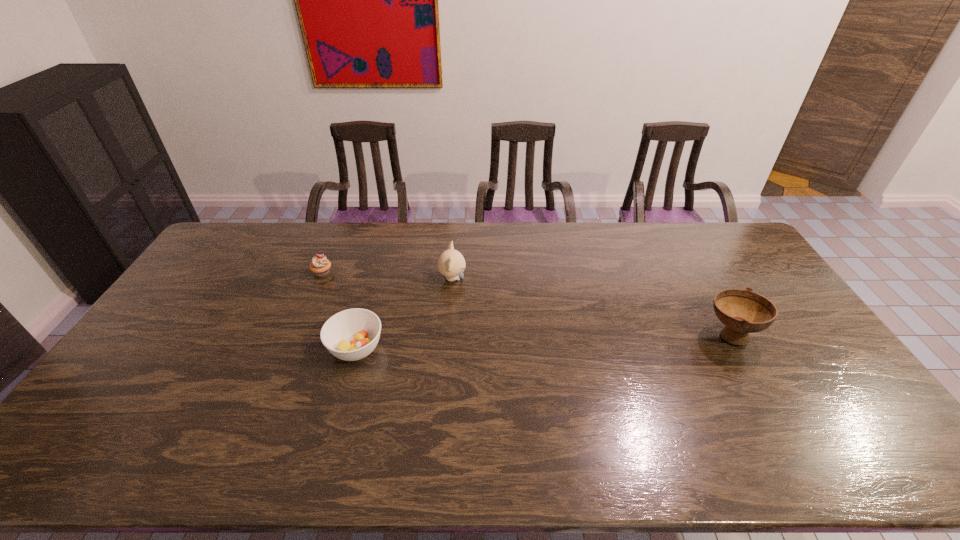
This screenshot has width=960, height=540. Identify the location of free point between the shorter soup bowl and the leftmost object. (339, 310).

Find the location of a particular element. free area in between the leftmost object and the shorter soup bowl is located at coordinates (339, 310).

Image resolution: width=960 pixels, height=540 pixels. Identify the location of vacant area that lies between the kitten and the shorter soup bowl. (404, 313).

What are the coordinates of `free space that is in between the left soup bowl and the second object from right to left` in the screenshot? It's located at (404, 313).

This screenshot has width=960, height=540. I want to click on vacant space that's between the kitten and the right soup bowl, so click(x=591, y=307).

Find the location of a particular element. The image size is (960, 540). unoccupied area between the right soup bowl and the shorter soup bowl is located at coordinates (543, 342).

Identify which object is the third closest to the third object from right to left. Please provide its 2D coordinates. Your answer should be formatted as a tuple, i.e. [(x, y)], where the tuple contains the x and y coordinates of a point satisfying the conditions above.

[(742, 312)]

Locate which object ranks in proximity to the leftmost object. Please provide its 2D coordinates. Your answer should be formatted as a tuple, i.e. [(x, y)], where the tuple contains the x and y coordinates of a point satisfying the conditions above.

[(350, 335)]

Find the location of a particular element. This screenshot has width=960, height=540. free spot that satisfies the following two spatial constraints: 1. on the face of the kitten; 2. on the left side of the right soup bowl is located at coordinates (448, 335).

This screenshot has width=960, height=540. Identify the location of blank space that satisfies the following two spatial constraints: 1. on the face of the rightmost object; 2. on the left side of the kitten. (448, 335).